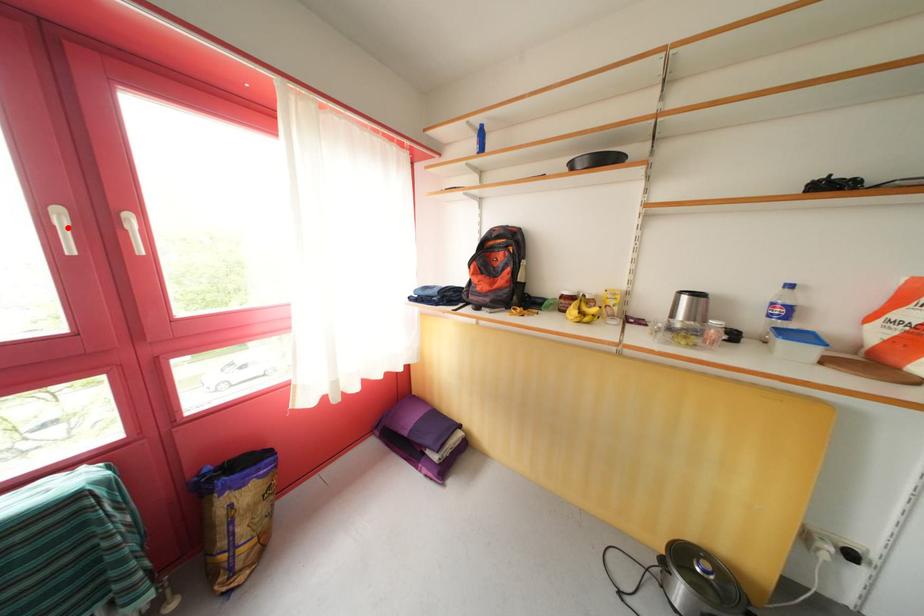
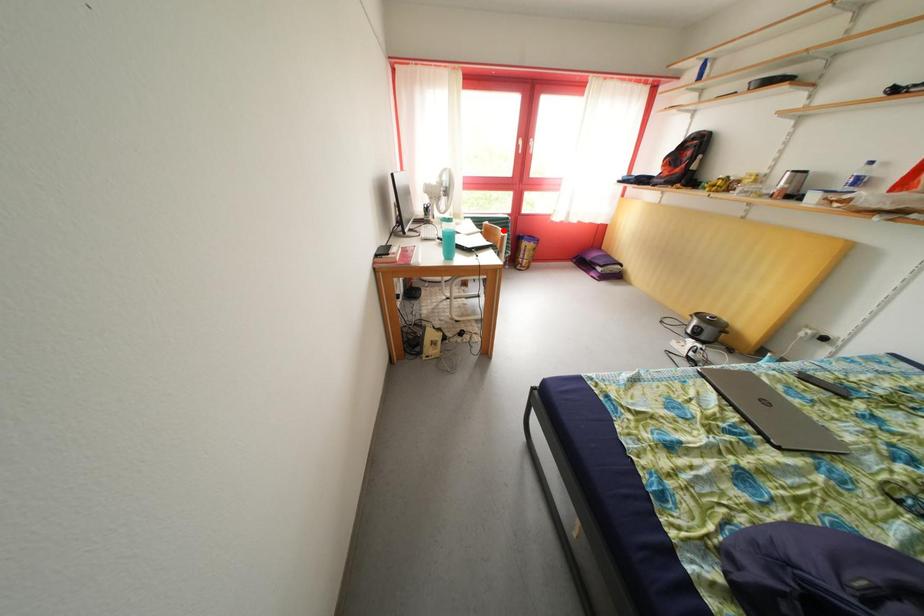
Based on the photo, I am providing you with two images of the same scene from different viewpoints. A red point is marked on the first image and another point is marked on the second image. Are the points marked in image1 and image2 representing the same 3D position?

No